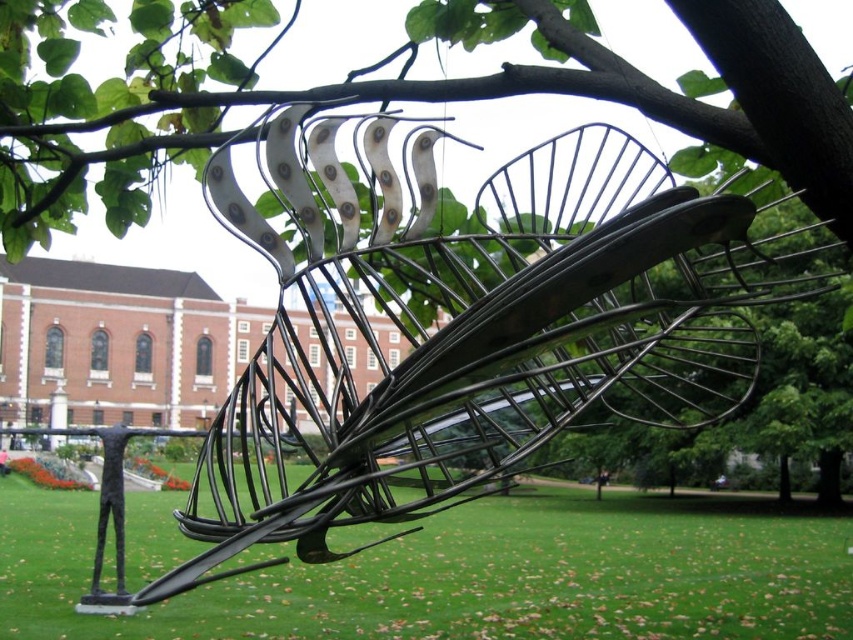
You are standing at the center of the park and see the black wire sculpture at center. Based on the coordinates provided, can you determine if the sculpture is closer to the northern or southern part of the park?

The coordinates of the black wire sculpture at center are at point (463, 326). Since the y coordinate is 0.545, which is above the halfway point of 0.5, the sculpture is closer to the northern part of the park.

You are a gardener who needs to place a new flower pot between the black wire sculpture at center and the green grass at lower center. Based on their positions, which object should the flower pot be closer to?

The black wire sculpture at center is positioned on the left side of green grass at lower center. Therefore, the flower pot should be placed closer to the black wire sculpture at center to maintain symmetry between the two objects.

You are a landscape architect designing a pathway that must pass between the black wire sculpture at center and the green grass at lower center. The pathway must be at least 2 meters wide to accommodate visitors. Can the pathway fit between them?

The distance between the black wire sculpture at center and the green grass at lower center is 25.81 meters, which is more than sufficient for a 2 meter wide pathway. Yes, the pathway can easily fit between them.